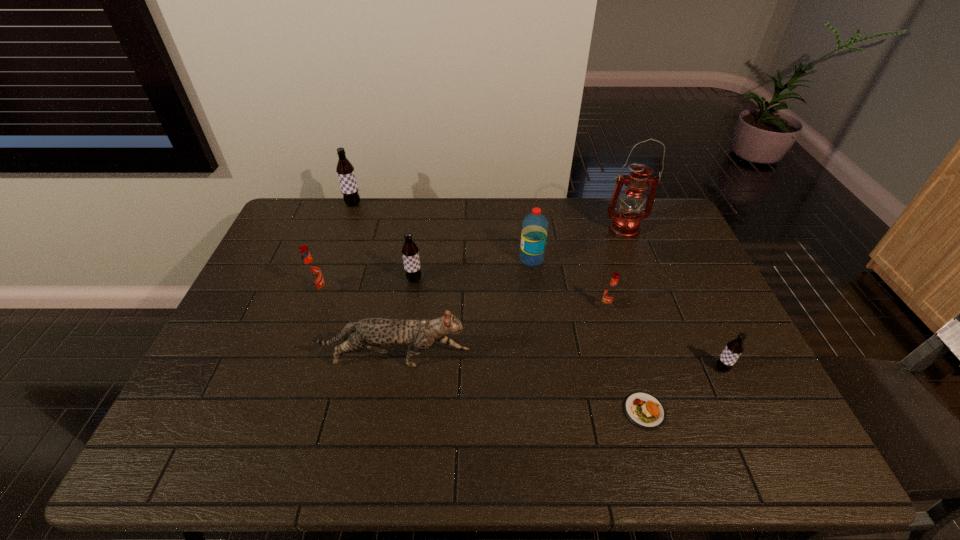
Find the location of a particular element. The image size is (960, 540). vacant space situated on the front label of the seventh nearest object is located at coordinates (439, 259).

Locate an element on the screen. The height and width of the screenshot is (540, 960). vacant area situated on the front label of the seventh nearest object is located at coordinates (442, 259).

This screenshot has width=960, height=540. What are the coordinates of `vacant space located 0.370m on the back of the fifth nearest object` in the screenshot? It's located at (348, 215).

Where is `vacant space situated on the back of the second brown root beer from left to right`? vacant space situated on the back of the second brown root beer from left to right is located at coordinates (420, 247).

The height and width of the screenshot is (540, 960). What are the coordinates of `free location located 0.380m on the face of the cat` in the screenshot? It's located at (616, 360).

At what (x,y) coordinates should I click in order to perform the action: click on free space located 0.130m on the back of the second nearest root beer. Please return your answer as a coordinate pair (x, y). This screenshot has height=540, width=960. Looking at the image, I should click on (597, 273).

Identify the location of free space located on the left of the nearest root beer. This screenshot has width=960, height=540. (679, 369).

In order to click on vacant space positioned 0.110m on the right of the nearest object in this screenshot , I will do `click(711, 411)`.

I want to click on oil lamp present at the far edge, so click(625, 224).

Locate an element on the screen. The width and height of the screenshot is (960, 540). root beer positioned at the far edge is located at coordinates [345, 170].